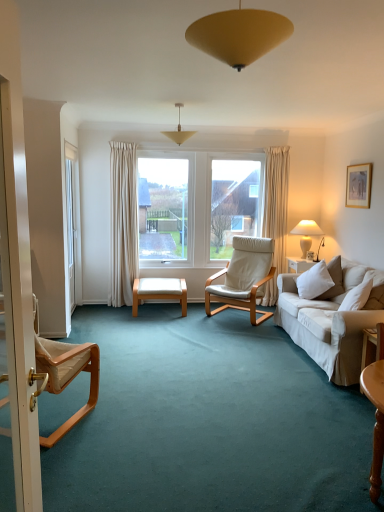
Question: From the image's perspective, is matte yellow pendant light at upper center, the third lamp in the bottom-to-top sequence, positioned above or below white leather chair at center, which is the 1th chair from right to left?

Choices:
 (A) below
 (B) above

Answer: (B)

Question: Is point (173, 135) positioned closer to the camera than point (258, 242)?

Choices:
 (A) farther
 (B) closer

Answer: (A)

Question: Estimate the real-world distances between objects in this image. Which object is closer to the white soft cushion at right?

Choices:
 (A) wooden picture frame at upper right
 (B) matte white screen door at left, the second screen door from the back
 (C) white leather chair at center, which is counted as the second chair, starting from the front
 (D) matte yellow cone at upper center, the second lamp viewed from the top
 (E) light brown wood chair at left, which appears as the 1th chair when viewed from the left

Answer: (C)

Question: Which object is the farthest from the white soft cushion at right?

Choices:
 (A) white glass screen door at left, which is the first screen door in back-to-front order
 (B) matte yellow pendant light at upper center, the third lamp positioned from the right
 (C) light brown wood chair at left, the 2th chair in the right-to-left sequence
 (D) matte yellow cone at upper center, which is counted as the 2th lamp, starting from the left
 (E) wooden picture frame at upper right

Answer: (D)